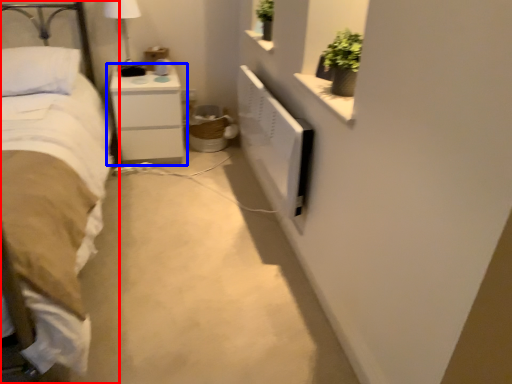
Question: Among these objects, which one is farthest to the camera, bed (highlighted by a red box) or nightstand (highlighted by a blue box)?

Choices:
 (A) bed
 (B) nightstand

Answer: (B)